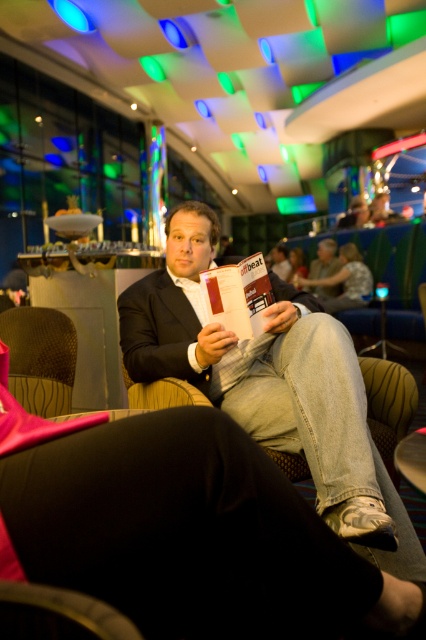
Which of these two, brown textured armchair at lower left or red matte magazine at center, stands shorter?

red matte magazine at center

This screenshot has height=640, width=426. In order to click on brown textured armchair at lower left in this screenshot , I will do `click(40, 358)`.

Between point (316, 349) and point (49, 634), which one is positioned in front?

Point (49, 634) is more forward.

Is matte black jacket at center in front of metallic gold chair at lower left?

That is False.

Is point (221, 344) positioned after point (63, 618)?

That is True.

Identify the location of matte black jacket at center. The width and height of the screenshot is (426, 640). (268, 380).

Who is shorter, matte black jacket at center or red matte magazine at center?

Standing shorter between the two is red matte magazine at center.

In the scene shown: Can you confirm if matte black jacket at center is shorter than red matte magazine at center?

No, matte black jacket at center is not shorter than red matte magazine at center.

This screenshot has width=426, height=640. What do you see at coordinates (268, 380) in the screenshot?
I see `matte black jacket at center` at bounding box center [268, 380].

Locate an element on the screen. This screenshot has height=640, width=426. matte black jacket at center is located at coordinates (268, 380).